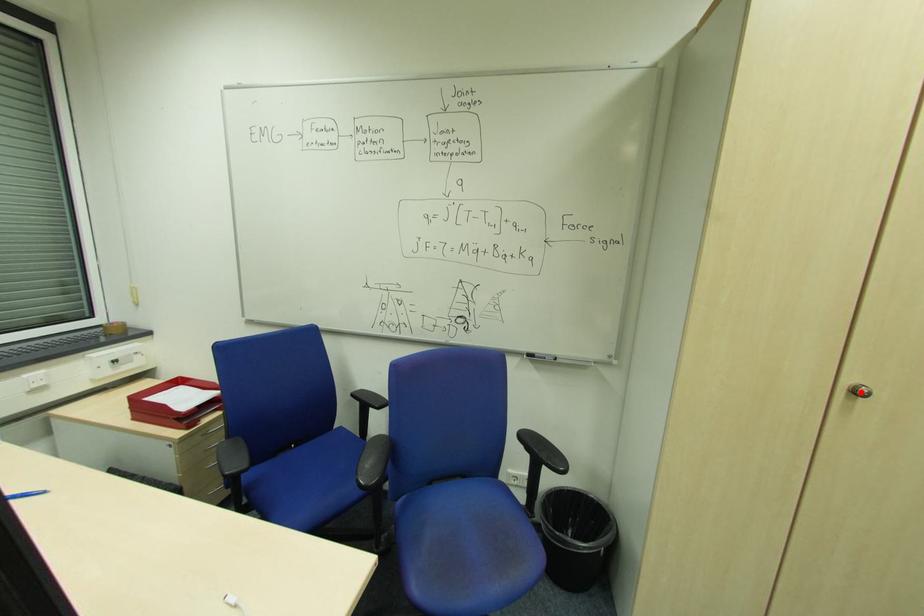
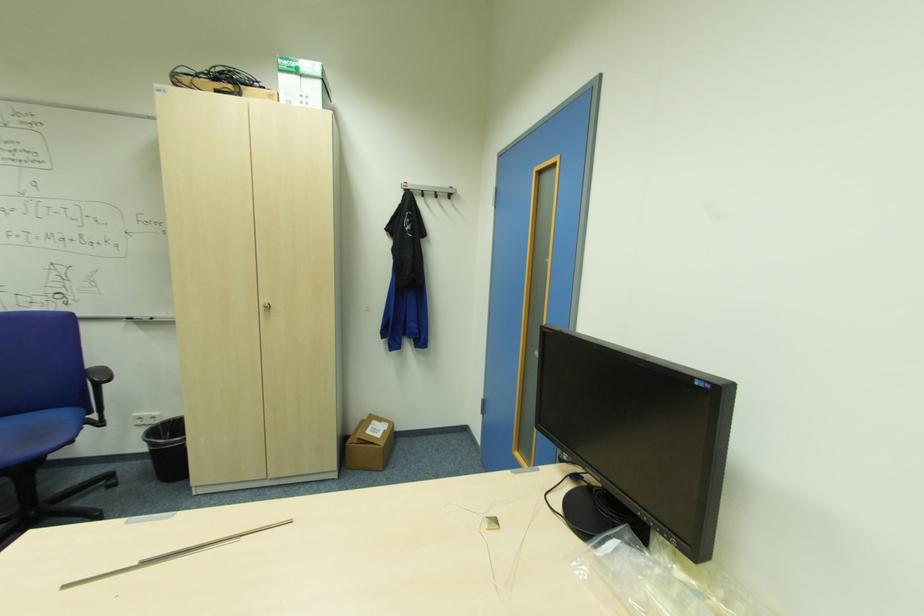
Question: I am providing you with two images of the same scene from different viewpoints. Image1 has a red point marked. In image2, the corresponding 3D location appears at what relative position? Reply with the corresponding letter.

Choices:
 (A) Closer
 (B) Farther

Answer: (B)